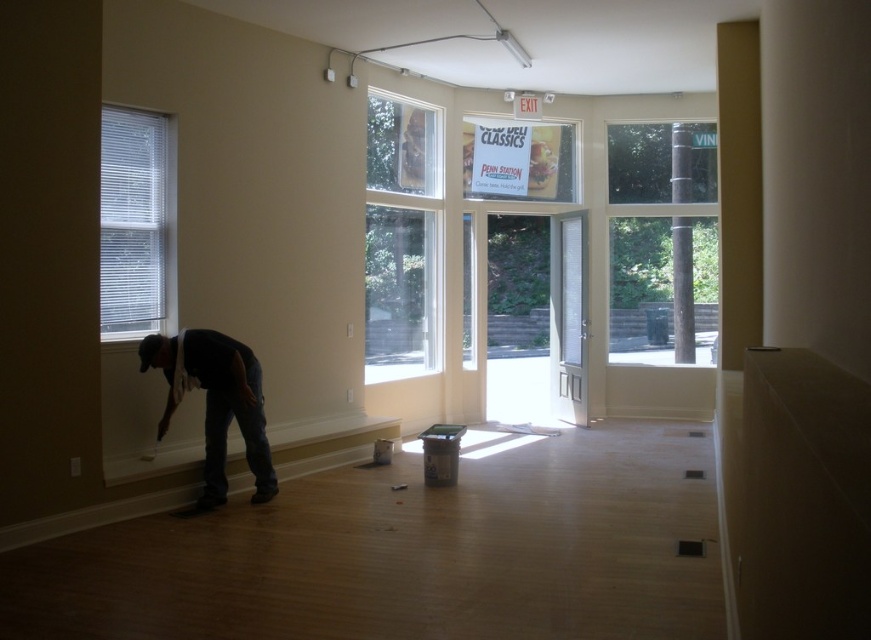
Who is positioned more to the left, clear glass door at center or white blinds at left?

white blinds at left is more to the left.

Which is in front, point (505, 236) or point (127, 189)?

Point (127, 189) is in front.

Identify the location of clear glass door at center. This screenshot has height=640, width=871. (537, 316).

Based on the photo, is clear glass window at upper right further to camera compared to white blinds at left?

Yes.

Between point (697, 209) and point (106, 200), which one is positioned in front?

Point (106, 200)

Does point (609, 284) come behind point (154, 321)?

That is True.

Locate an element on the screen. This screenshot has width=871, height=640. clear glass window at upper right is located at coordinates (662, 241).

Is the position of white blinds at left more distant than that of denim jeans at lower left?

Yes, white blinds at left is further from the viewer.

Consider the image. Can you confirm if white blinds at left is positioned to the left of denim jeans at lower left?

Correct, you'll find white blinds at left to the left of denim jeans at lower left.

Does point (133, 328) come farther from viewer compared to point (208, 461)?

Yes.

Find the location of a particular element. The width and height of the screenshot is (871, 640). white blinds at left is located at coordinates [133, 221].